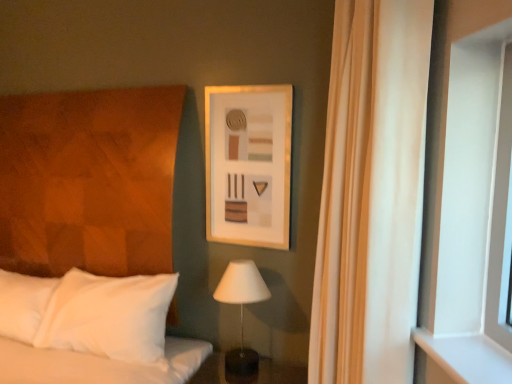
Question: Is white matte window at right in contact with matte wooden picture frame at upper center?

Choices:
 (A) no
 (B) yes

Answer: (A)

Question: Could you tell me if white matte window at right is facing matte wooden picture frame at upper center?

Choices:
 (A) no
 (B) yes

Answer: (A)

Question: Can you confirm if white matte window at right is smaller than matte wooden picture frame at upper center?

Choices:
 (A) yes
 (B) no

Answer: (A)

Question: From the image's perspective, does white matte window at right appear higher than matte wooden picture frame at upper center?

Choices:
 (A) yes
 (B) no

Answer: (B)

Question: Is white matte window at right closer to the viewer compared to matte wooden picture frame at upper center?

Choices:
 (A) yes
 (B) no

Answer: (A)

Question: Can you confirm if white matte window at right is taller than matte wooden picture frame at upper center?

Choices:
 (A) yes
 (B) no

Answer: (A)

Question: Considering the relative sizes of white matte table lamp at center and white matte window at right in the image provided, is white matte table lamp at center wider than white matte window at right?

Choices:
 (A) no
 (B) yes

Answer: (B)

Question: Is white matte table lamp at center shorter than white matte window at right?

Choices:
 (A) no
 (B) yes

Answer: (B)

Question: Does white matte table lamp at center have a greater height compared to white matte window at right?

Choices:
 (A) no
 (B) yes

Answer: (A)

Question: Does white matte table lamp at center have a larger size compared to white matte window at right?

Choices:
 (A) no
 (B) yes

Answer: (B)

Question: From the image's perspective, is white matte table lamp at center located beneath white matte window at right?

Choices:
 (A) no
 (B) yes

Answer: (B)

Question: Is the depth of white matte table lamp at center less than that of white matte window at right?

Choices:
 (A) yes
 (B) no

Answer: (B)

Question: Is matte wooden picture frame at upper center far from white matte table lamp at center?

Choices:
 (A) yes
 (B) no

Answer: (B)